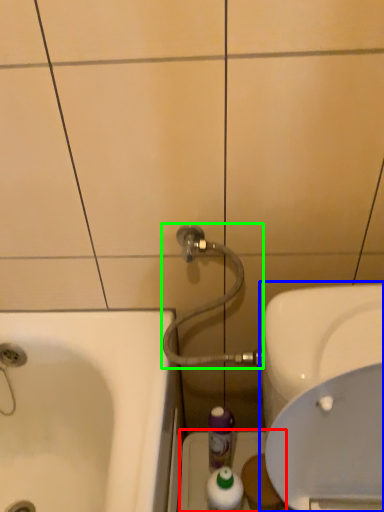
Question: Considering the real-world distances, which object is closest to porcelain (highlighted by a red box)? sink (highlighted by a blue box) or shower (highlighted by a green box).

Choices:
 (A) sink
 (B) shower

Answer: (B)